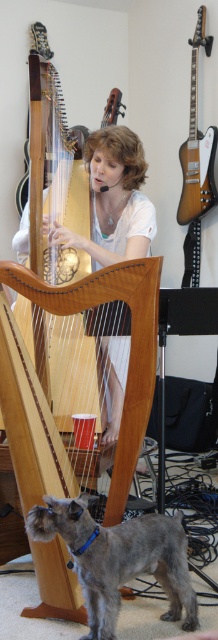
Question: Does gray fur dog at lower left appear on the left side of satin-finished electric guitar at upper right?

Choices:
 (A) no
 (B) yes

Answer: (B)

Question: Which object is farther from the camera taking this photo?

Choices:
 (A) gray fur dog at lower left
 (B) satin-finished electric guitar at upper right

Answer: (B)

Question: Can you confirm if gray fur dog at lower left is positioned to the left of satin-finished electric guitar at upper right?

Choices:
 (A) no
 (B) yes

Answer: (B)

Question: Does gray fur dog at lower left appear under satin-finished electric guitar at upper right?

Choices:
 (A) yes
 (B) no

Answer: (A)